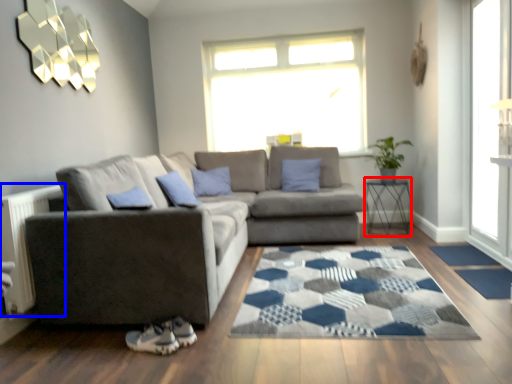
Question: Which object appears closest to the camera in this image, table (highlighted by a red box) or radiator (highlighted by a blue box)?

Choices:
 (A) table
 (B) radiator

Answer: (B)